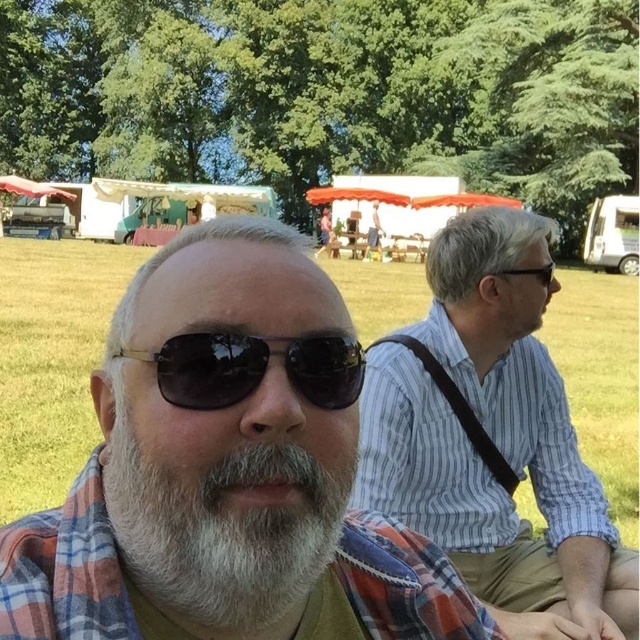
You are a photographer trying to capture both the blue striped shirt at right and the white matte beard at center in a single shot. Which object should you focus on first to ensure both are in frame?

The blue striped shirt at right is larger in size than the white matte beard at center, so you should focus on the blue striped shirt at right first to ensure both are in frame.

What are the coordinates of the white matte beard at center?

The white matte beard at center is located at coordinates point [225,513].

You are a photographer trying to capture a clear shot of both the white matte beard at center and the metallic aviator sunglasses at center. Based on their positions, which object is closer to the camera?

The white matte beard at center is positioned under the metallic aviator sunglasses at center, meaning the metallic aviator sunglasses at center is closer to the camera.